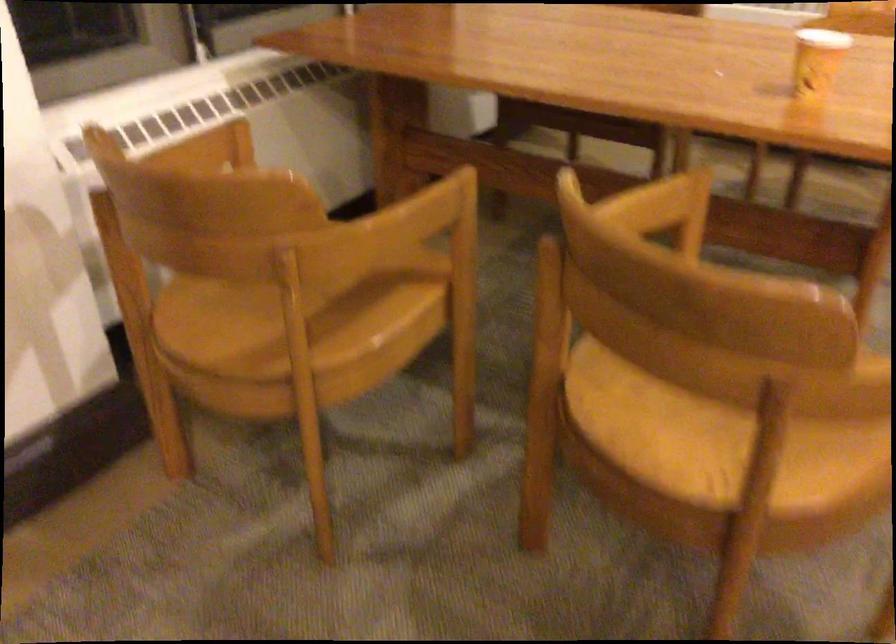
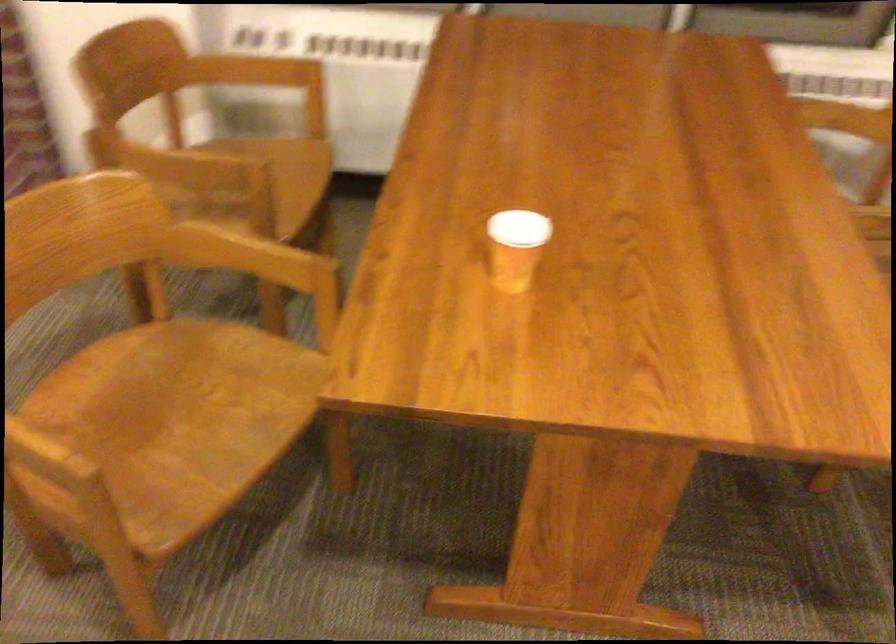
Where in the second image is the point corresponding to pixel 636 214 from the first image?

(248, 257)